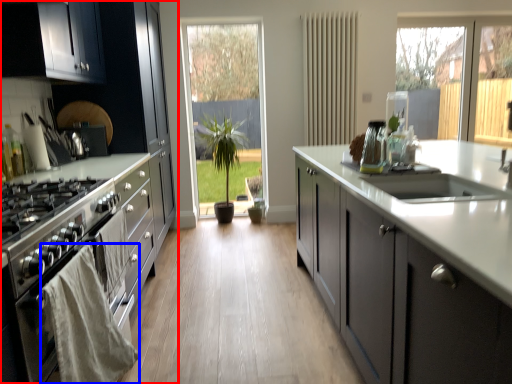
Question: Which object appears farthest to the camera in this image, cabinetry (highlighted by a red box) or material (highlighted by a blue box)?

Choices:
 (A) cabinetry
 (B) material

Answer: (A)